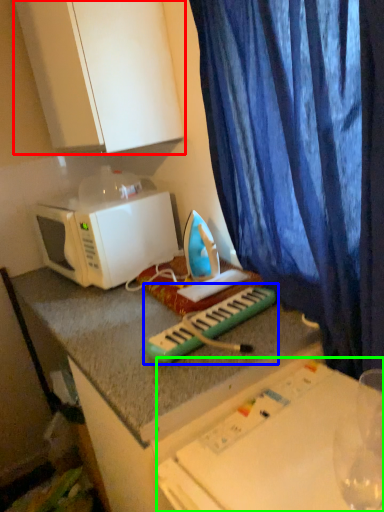
Question: Which object is the farthest from cabinetry (highlighted by a red box)? Choose among these: musical keyboard (highlighted by a blue box) or table (highlighted by a green box).

Choices:
 (A) musical keyboard
 (B) table

Answer: (B)